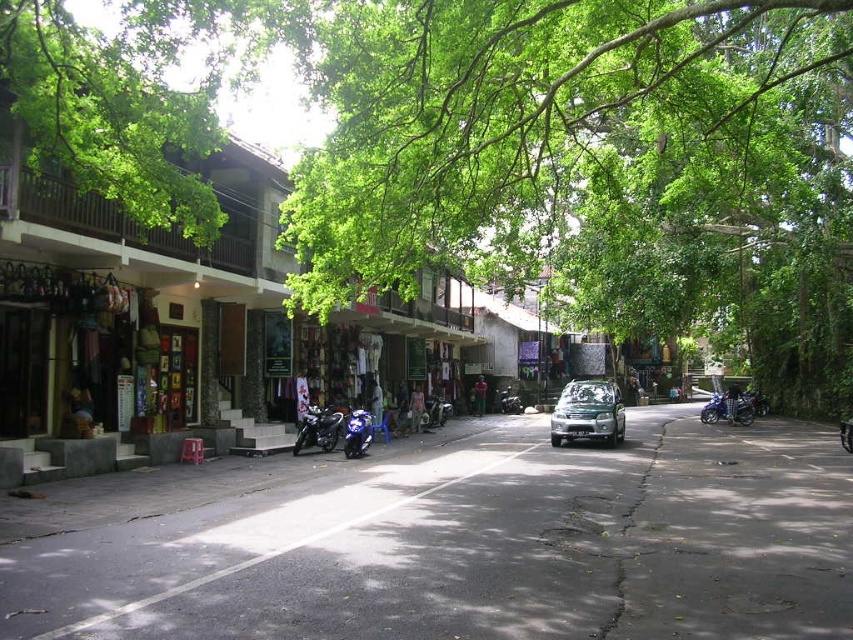
Who is shorter, blue metallic motorcycle at center or blue matte motorcycle at center?

blue metallic motorcycle at center

What do you see at coordinates (437, 410) in the screenshot?
I see `blue metallic motorcycle at center` at bounding box center [437, 410].

Is point (450, 413) closer to viewer compared to point (508, 410)?

Yes, it is in front of point (508, 410).

Identify the location of blue metallic motorcycle at center. This screenshot has height=640, width=853. (437, 410).

Is shiny blue motorcycle at center to the left of blue metallic motorcycle at center from the viewer's perspective?

Yes, shiny blue motorcycle at center is to the left of blue metallic motorcycle at center.

Does shiny blue motorcycle at center have a greater height compared to blue metallic motorcycle at center?

Correct, shiny blue motorcycle at center is much taller as blue metallic motorcycle at center.

This screenshot has height=640, width=853. Describe the element at coordinates (318, 428) in the screenshot. I see `shiny blue motorcycle at center` at that location.

The width and height of the screenshot is (853, 640). Identify the location of shiny blue motorcycle at center. (318, 428).

Who is higher up, green leafy tree at center or blue matte motorcycle at center?

green leafy tree at center is higher up.

Which is more to the left, green leafy tree at center or blue matte motorcycle at center?

blue matte motorcycle at center is more to the left.

Locate an element on the screen. This screenshot has height=640, width=853. green leafy tree at center is located at coordinates (595, 168).

Identify the location of green leafy tree at center. (595, 168).